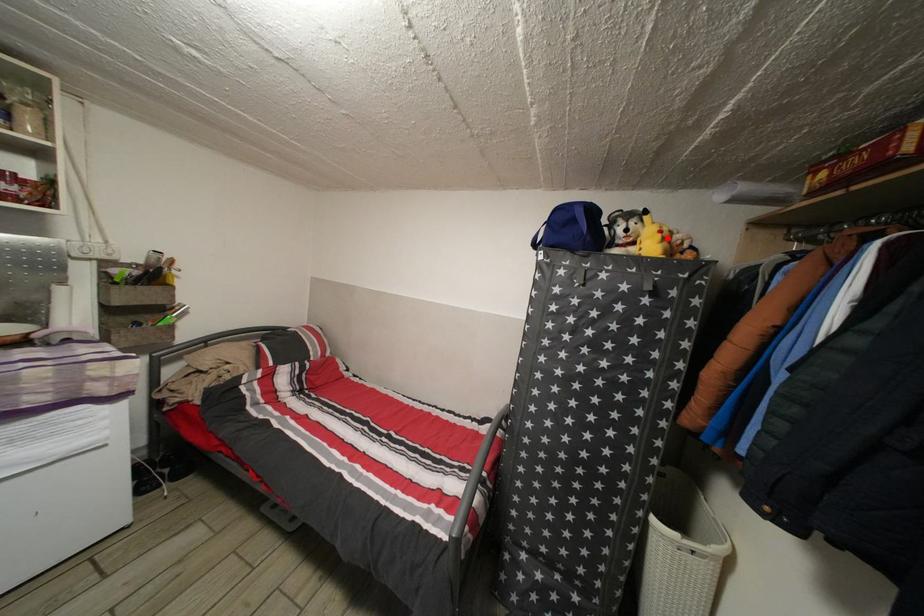
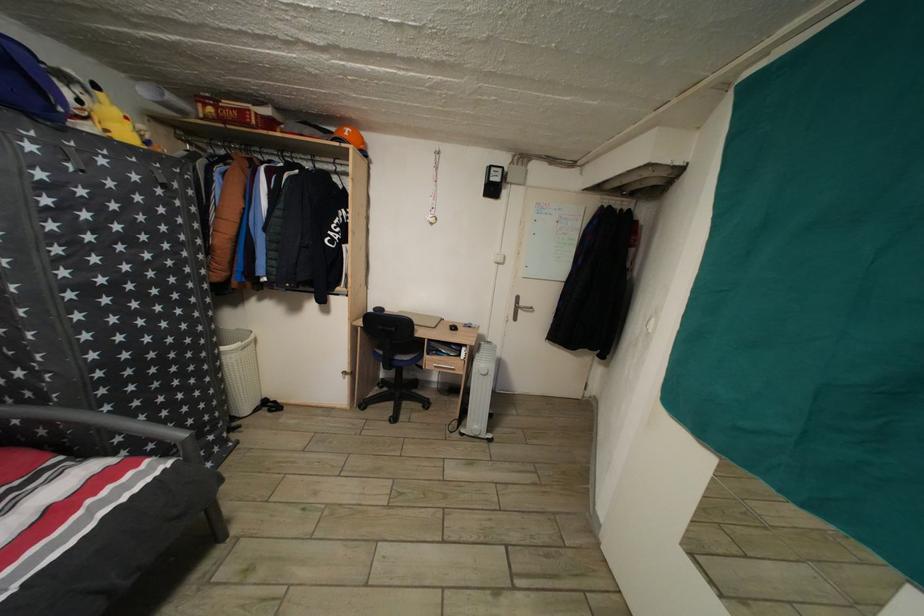
The point at the highlighted location is marked in the first image. Where is the corresponding point in the second image?

(134, 124)